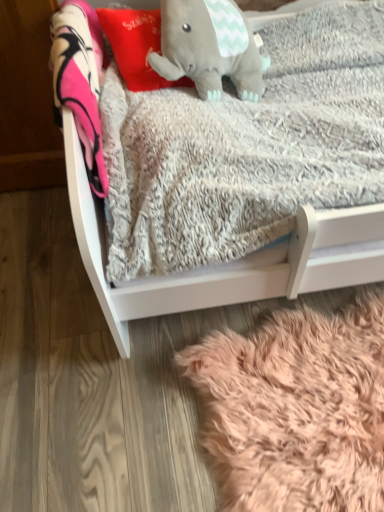
Where is `free space to the left of fuzzy pink rug at lower right`? This screenshot has height=512, width=384. free space to the left of fuzzy pink rug at lower right is located at coordinates (86, 391).